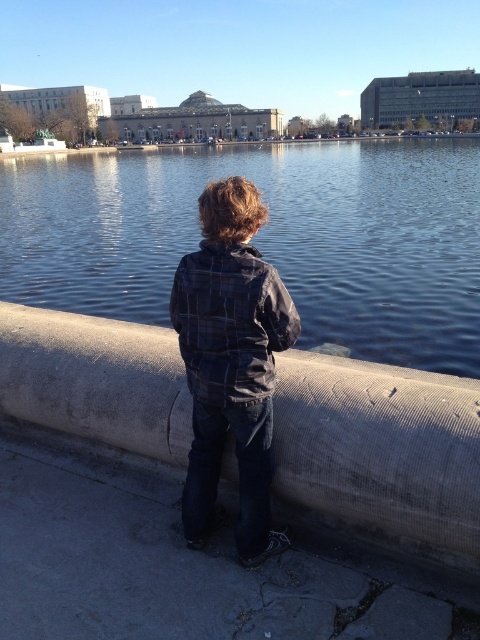
Question: From the image, what is the correct spatial relationship of concrete at center in relation to plaid fabric jacket at center?

Choices:
 (A) left
 (B) right

Answer: (A)

Question: Among these points, which one is farthest from the camera?

Choices:
 (A) 180,394
 (B) 282,344
 (C) 216,204
 (D) 396,218

Answer: (D)

Question: Which point is closer to the camera?

Choices:
 (A) concrete at center
 (B) plaid fabric jacket at center
 (C) blue water at center
 (D) plaid cotton jacket at center

Answer: (D)

Question: Observing the image, what is the correct spatial positioning of blue water at center in reference to plaid cotton jacket at center?

Choices:
 (A) right
 (B) left

Answer: (B)

Question: Which of these objects is positioned farthest from the plaid fabric jacket at center?

Choices:
 (A) plaid cotton jacket at center
 (B) blue water at center
 (C) concrete at center

Answer: (B)

Question: Does blue water at center lie behind concrete at center?

Choices:
 (A) no
 (B) yes

Answer: (B)